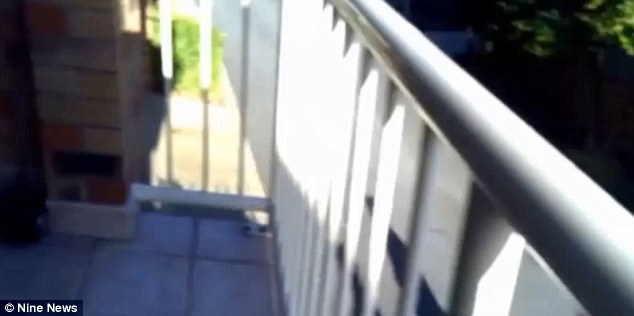
At what (x,y) coordinates should I click in order to perform the action: click on pillar trim piece. Please return your answer as a coordinate pair (x, y). Looking at the image, I should click on (104, 224).